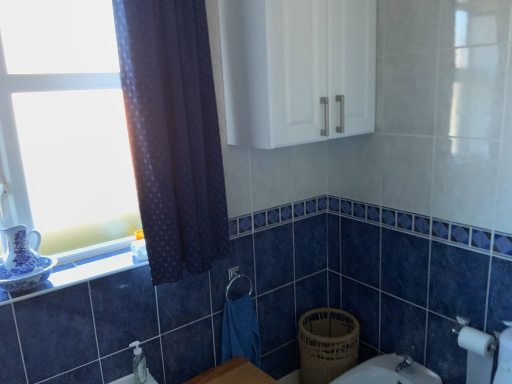
Question: Can you confirm if blue fabric hand towel at lower center is wider than dark blue sheer curtain at left?

Choices:
 (A) yes
 (B) no

Answer: (B)

Question: Is blue fabric hand towel at lower center to the right of dark blue sheer curtain at left from the viewer's perspective?

Choices:
 (A) no
 (B) yes

Answer: (B)

Question: Does blue fabric hand towel at lower center have a greater height compared to dark blue sheer curtain at left?

Choices:
 (A) yes
 (B) no

Answer: (B)

Question: Is blue fabric hand towel at lower center aimed at dark blue sheer curtain at left?

Choices:
 (A) no
 (B) yes

Answer: (A)

Question: Is blue fabric hand towel at lower center shorter than dark blue sheer curtain at left?

Choices:
 (A) yes
 (B) no

Answer: (A)

Question: From a real-world perspective, relative to white matte toilet paper at lower right, is blue fabric hand towel at lower center vertically above or below?

Choices:
 (A) above
 (B) below

Answer: (A)

Question: Looking at the image, does blue fabric hand towel at lower center seem bigger or smaller compared to white matte toilet paper at lower right?

Choices:
 (A) big
 (B) small

Answer: (A)

Question: Is blue fabric hand towel at lower center spatially inside white matte toilet paper at lower right, or outside of it?

Choices:
 (A) inside
 (B) outside

Answer: (B)

Question: Is blue fabric hand towel at lower center in front of or behind white matte toilet paper at lower right in the image?

Choices:
 (A) behind
 (B) front

Answer: (A)

Question: Considering their positions, is woven brown basket at lower right located in front of or behind clear plastic soap dispenser at lower center?

Choices:
 (A) behind
 (B) front

Answer: (A)

Question: Based on their sizes in the image, would you say woven brown basket at lower right is bigger or smaller than clear plastic soap dispenser at lower center?

Choices:
 (A) small
 (B) big

Answer: (B)

Question: Which is correct: woven brown basket at lower right is inside clear plastic soap dispenser at lower center, or outside of it?

Choices:
 (A) outside
 (B) inside

Answer: (A)

Question: Based on their positions, is woven brown basket at lower right located to the left or right of clear plastic soap dispenser at lower center?

Choices:
 (A) left
 (B) right

Answer: (B)

Question: From a real-world perspective, relative to white glossy window sill at lower left, is dark blue sheer curtain at left vertically above or below?

Choices:
 (A) below
 (B) above

Answer: (B)

Question: In the image, is dark blue sheer curtain at left positioned in front of or behind white glossy window sill at lower left?

Choices:
 (A) behind
 (B) front

Answer: (B)